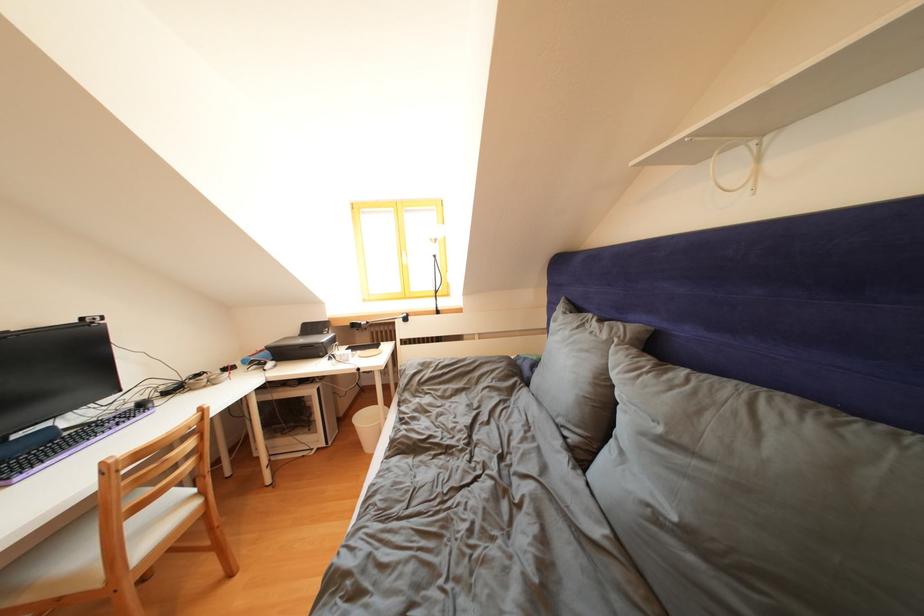
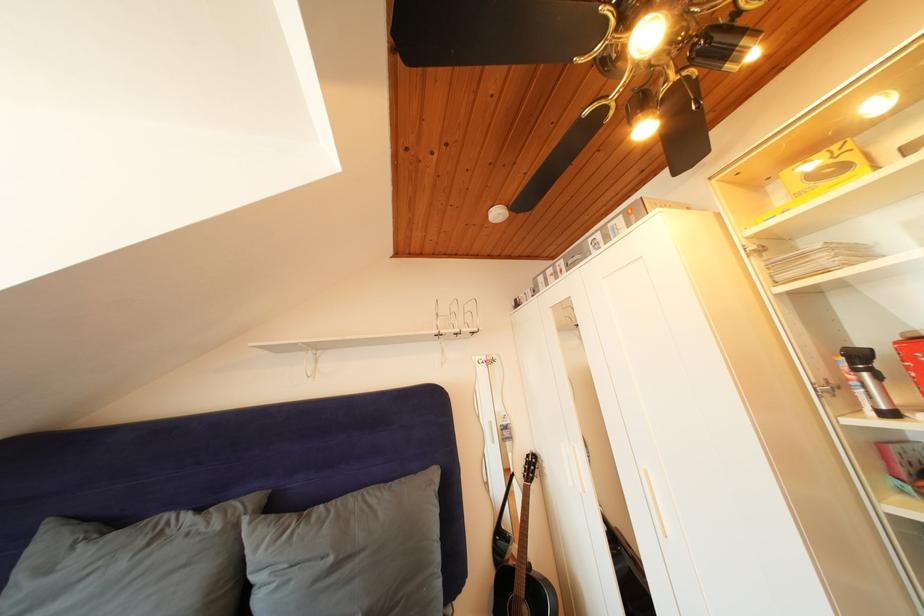
Where in the second image is the point corresponding to (667,435) from the first image?

(338, 565)